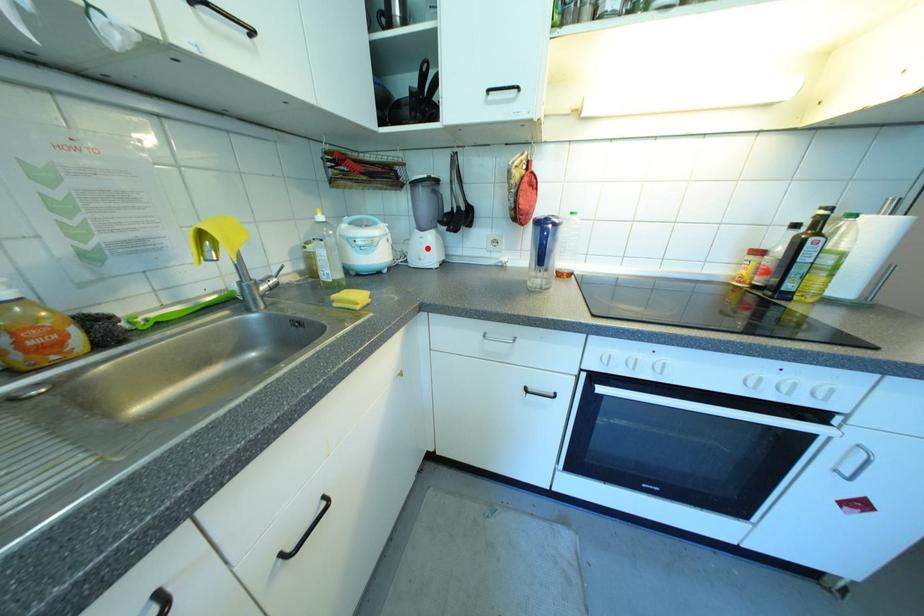
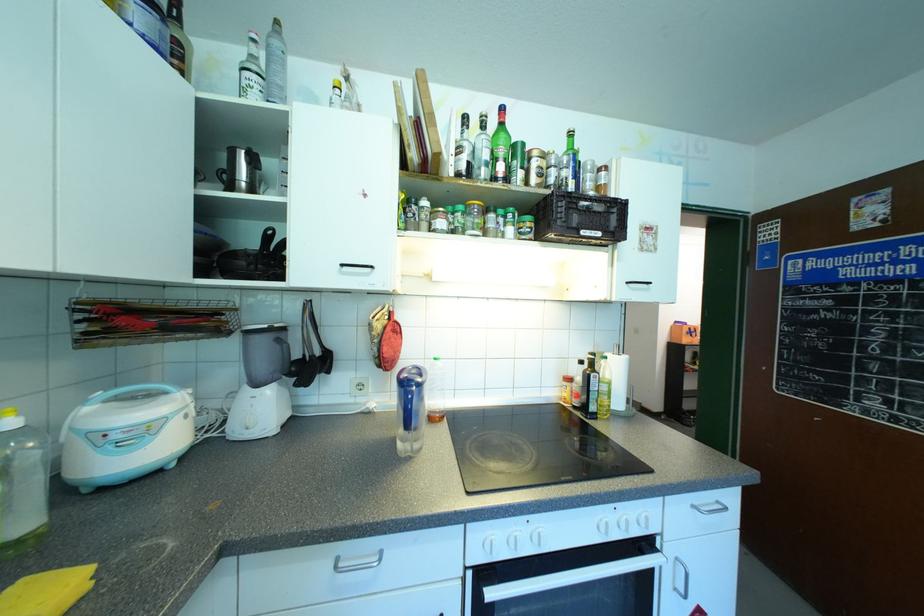
The point at the highlighted location is marked in the first image. Where is the corresponding point in the second image?

(262, 410)